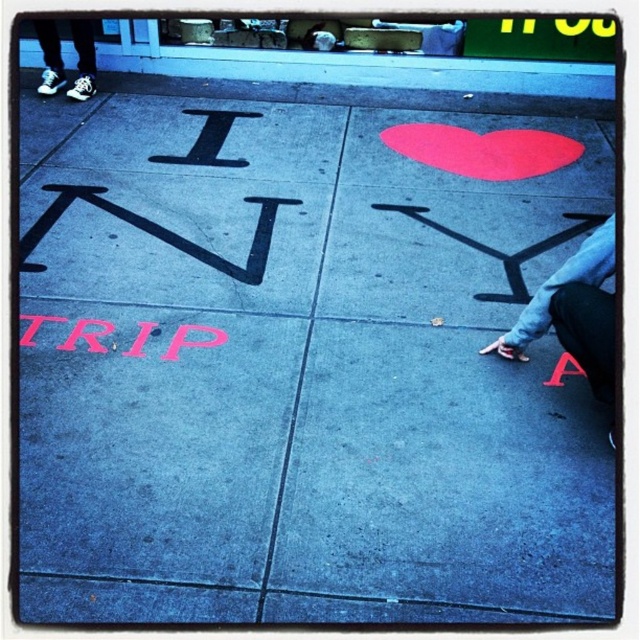
From the picture: Is light blue jeans at lower right positioned in front of pink matte trip at lower left?

That is True.

Between point (516, 323) and point (99, 337), which one is positioned in front?

Point (516, 323) is in front.

Which is in front, point (557, 326) or point (104, 346)?

Positioned in front is point (557, 326).

Locate an element on the screen. The height and width of the screenshot is (640, 640). light blue jeans at lower right is located at coordinates (573, 312).

Looking at this image, who is lower down, blue concrete curb at upper left or white canvas sneakers at upper left?

blue concrete curb at upper left

Can you confirm if blue concrete curb at upper left is positioned to the right of white canvas sneakers at upper left?

Indeed, blue concrete curb at upper left is positioned on the right side of white canvas sneakers at upper left.

I want to click on blue concrete curb at upper left, so click(x=365, y=70).

Locate an element on the screen. The height and width of the screenshot is (640, 640). blue concrete curb at upper left is located at coordinates (365, 70).

Which is below, blue concrete curb at upper left or light blue jeans at lower right?

light blue jeans at lower right is lower down.

You are a GUI agent. You are given a task and a screenshot of the screen. Output one action in this format:
    pyautogui.click(x=<x>, y=<y>)
    Task: Click on the blue concrete curb at upper left
    
    Given the screenshot: What is the action you would take?
    pyautogui.click(x=365, y=70)